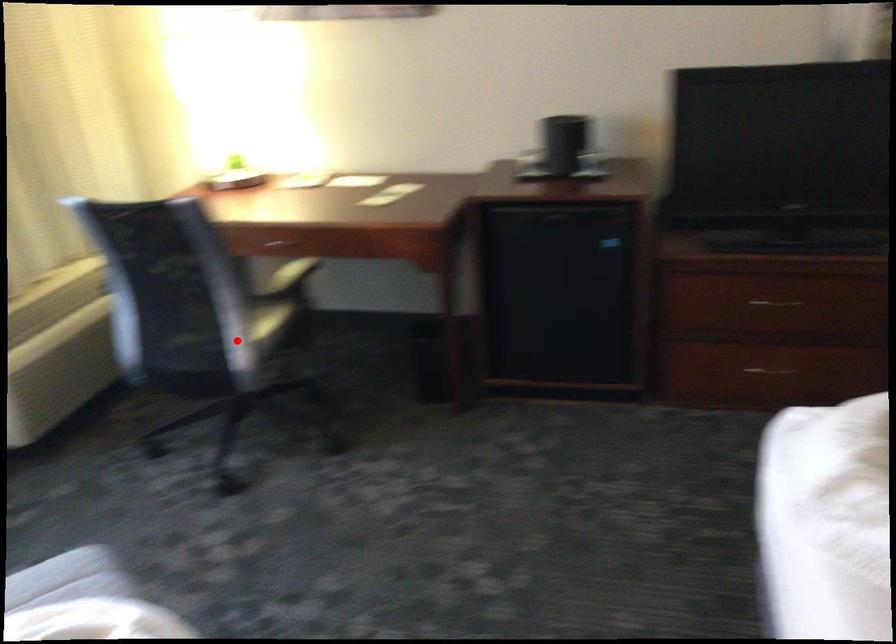
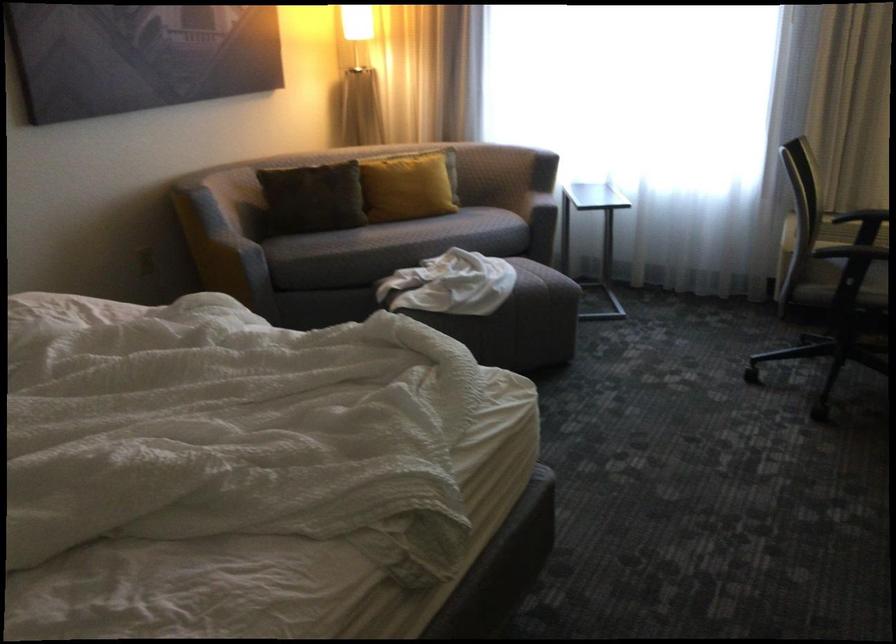
Find the pixel in the second image that matches the highlighted location in the first image.

(831, 294)